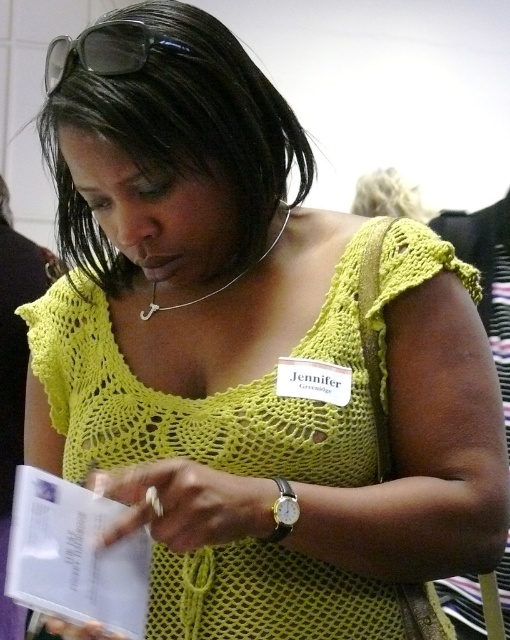
Question: Is white paper book at lower left wider than clear plastic goggles at upper center?

Choices:
 (A) no
 (B) yes

Answer: (A)

Question: In this image, where is white paper book at lower left located relative to clear plastic goggles at upper center?

Choices:
 (A) right
 (B) left

Answer: (B)

Question: Observing the image, what is the correct spatial positioning of white paper book at lower left in reference to clear plastic goggles at upper center?

Choices:
 (A) below
 (B) above

Answer: (A)

Question: Which object appears farthest from the camera in this image?

Choices:
 (A) clear plastic goggles at upper center
 (B) white paper book at lower left

Answer: (A)

Question: Which object appears closest to the camera in this image?

Choices:
 (A) white paper book at lower left
 (B) clear plastic goggles at upper center

Answer: (A)